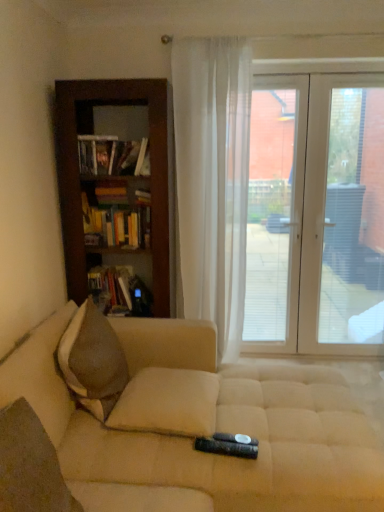
Where is `free spot above white glass door at right (from a real-world perspective)`? This screenshot has height=512, width=384. free spot above white glass door at right (from a real-world perspective) is located at coordinates (314, 76).